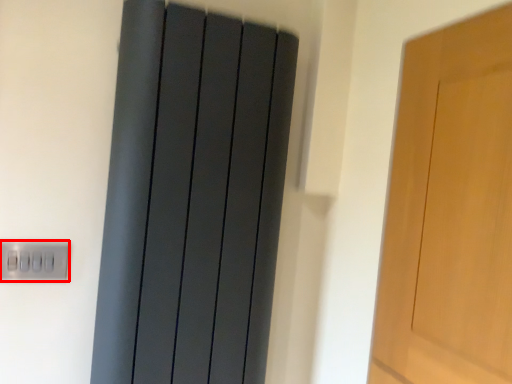
Question: Where is electric outlet (annotated by the red box) located in relation to curtain in the image?

Choices:
 (A) right
 (B) left

Answer: (B)